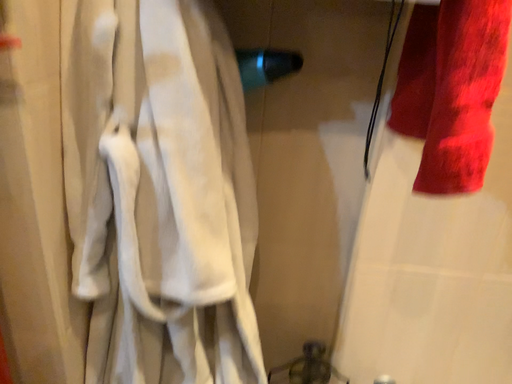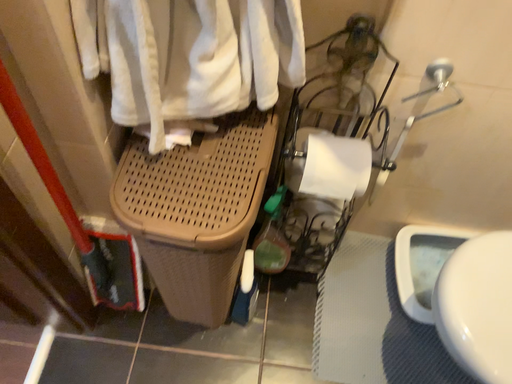
Question: Which way did the camera rotate in the video?

Choices:
 (A) rotated downward
 (B) rotated upward

Answer: (A)